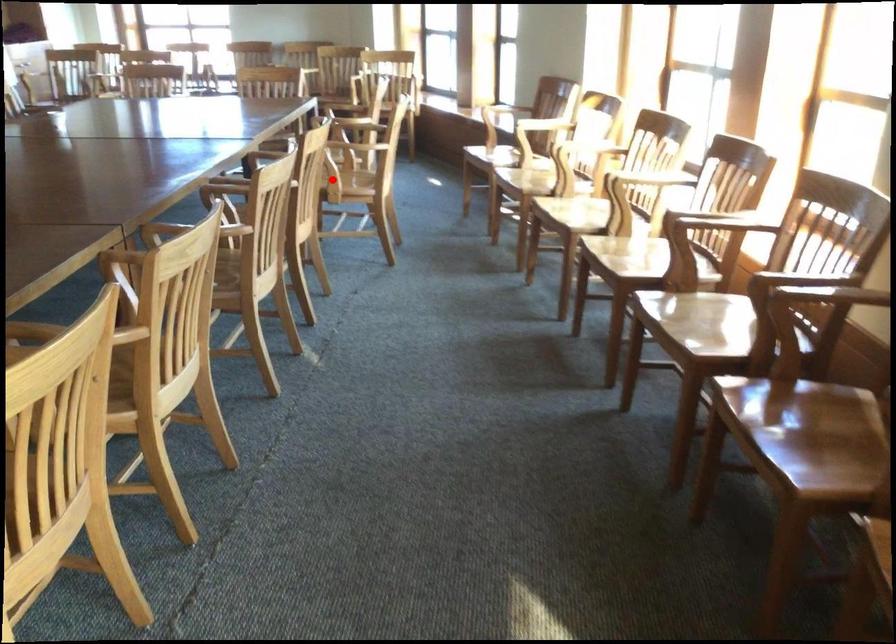
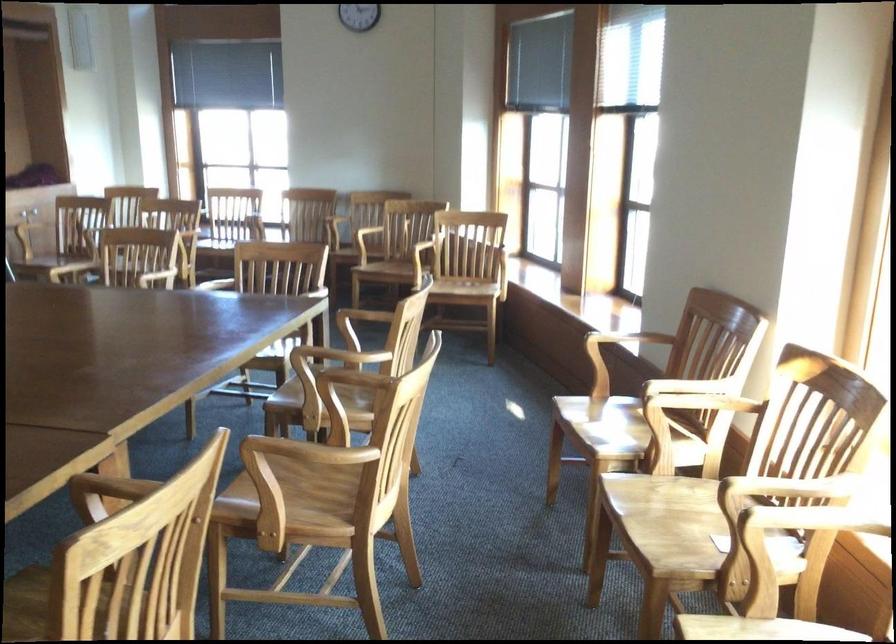
Find the pixel in the second image that matches the highlighted location in the first image.

(294, 489)